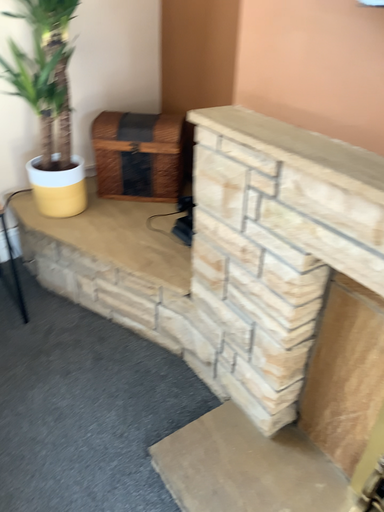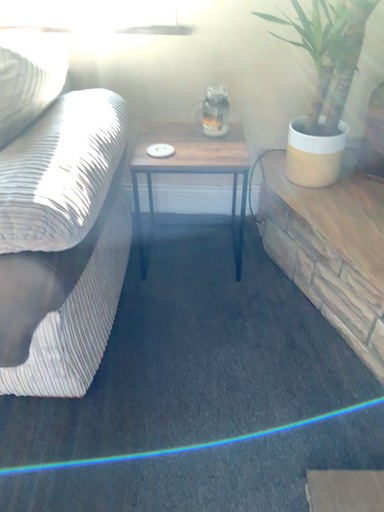
Question: How did the camera likely rotate when shooting the video?

Choices:
 (A) rotated right
 (B) rotated left

Answer: (B)